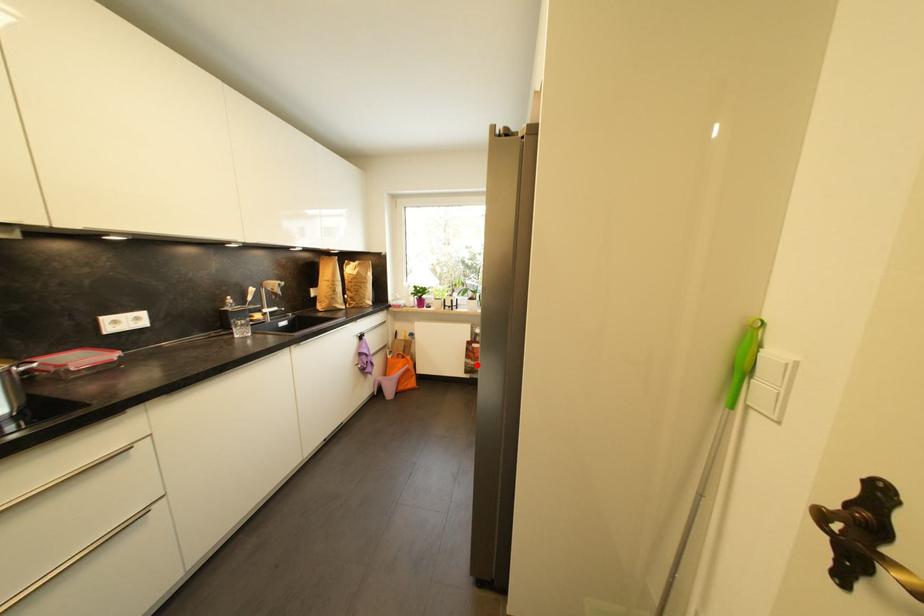
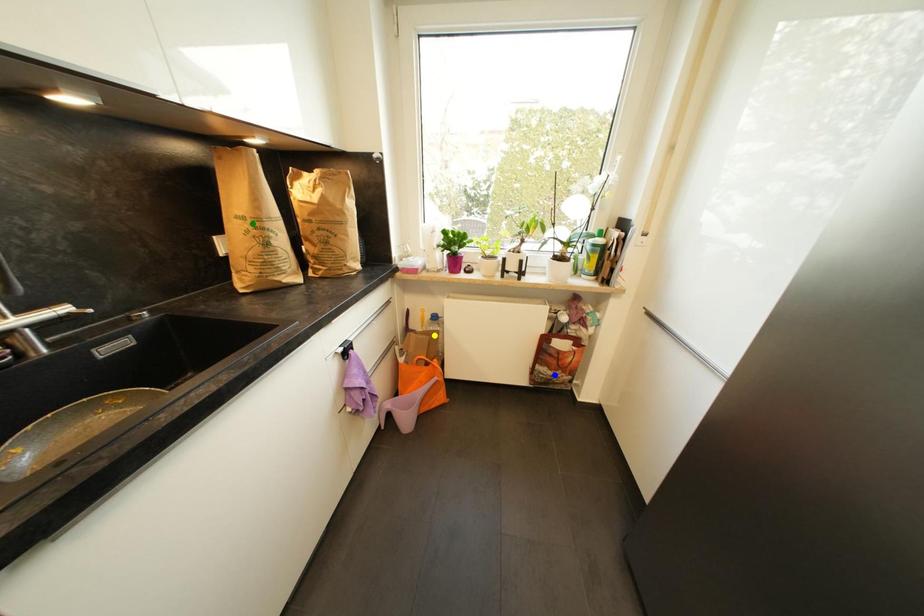
Question: I am providing you with two images of the same scene from different viewpoints. A red point is marked on the first image. You are given multiple points on the second image. Can you choose the point in image 2 that corresponds to the point in image 1?

Choices:
 (A) yellow point
 (B) blue point
 (C) green point

Answer: (B)